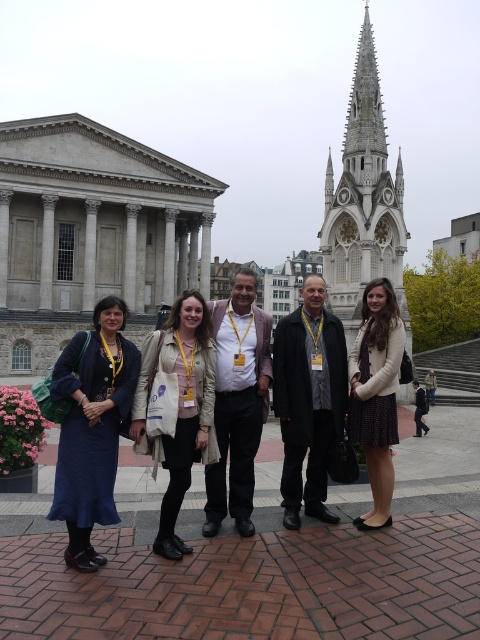
Based on the photo, is light brown leather jacket at center taller than matte beige coat at center?

Indeed, light brown leather jacket at center has a greater height compared to matte beige coat at center.

Who is positioned more to the right, light brown leather jacket at center or matte beige coat at center?

Positioned to the right is light brown leather jacket at center.

Does point (218, 305) come farther from viewer compared to point (184, 401)?

Yes, it is behind point (184, 401).

I want to click on light brown leather jacket at center, so click(238, 401).

Who is taller, matte blue skirt at left or matte white coat at center?

matte white coat at center

Between matte blue skirt at left and matte white coat at center, which one is positioned higher?

Positioned higher is matte white coat at center.

Who is more forward, (84,568) or (386,360)?

Point (84,568) is in front.

This screenshot has width=480, height=640. I want to click on matte blue skirt at left, so click(x=92, y=428).

How distant is light brown leather jacket at center from matte white coat at center?

The distance of light brown leather jacket at center from matte white coat at center is 34.34 feet.

Can you confirm if light brown leather jacket at center is positioned below matte white coat at center?

No.

Identify the location of light brown leather jacket at center. The image size is (480, 640). (238, 401).